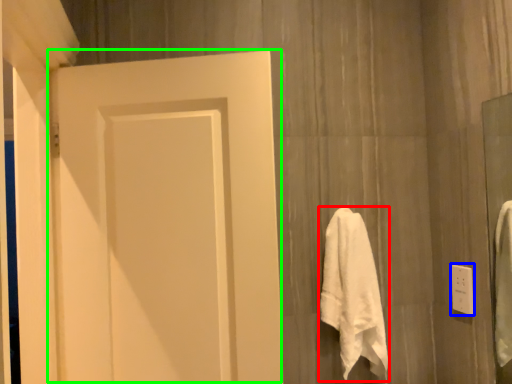
Question: Which object is the closest to the towel (highlighted by a red box)? Choose among these: electric outlet (highlighted by a blue box) or door (highlighted by a green box).

Choices:
 (A) electric outlet
 (B) door

Answer: (A)